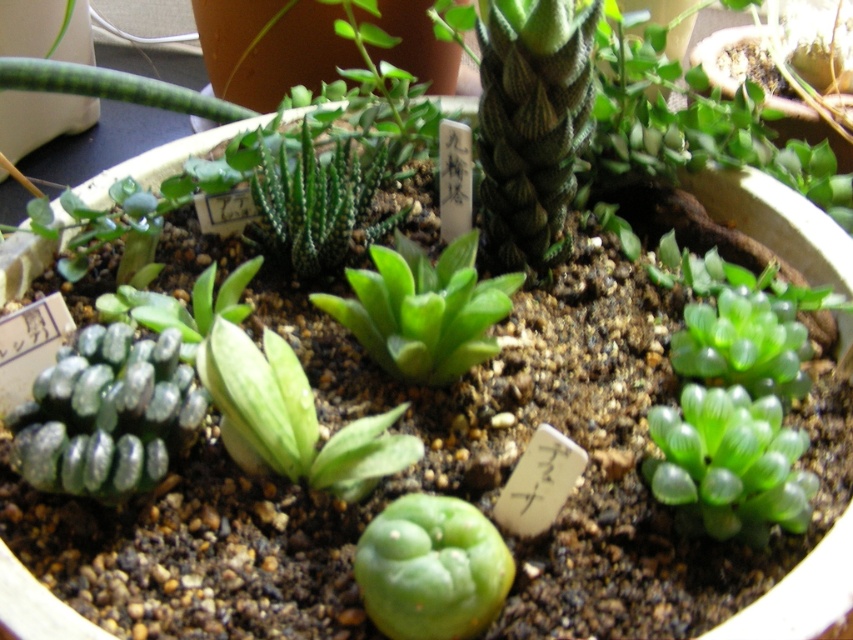
Question: Which object is farther from the camera taking this photo?

Choices:
 (A) translucent glass cylinder at center-right
 (B) green matte succulent at center

Answer: (A)

Question: Estimate the real-world distances between objects in this image. Which object is closer to the translucent glass cylinder at center-right?

Choices:
 (A) green textured stone at center
 (B) green matte/glossy cactus at center
 (C) green textured hexagonal cactus at center

Answer: (B)

Question: Considering the real-world distances, which object is closest to the green matte/glossy cactus at center?

Choices:
 (A) green matte succulent at center
 (B) translucent glass cylinder at center-right
 (C) green textured hexagonal cactus at center

Answer: (A)

Question: Can you confirm if translucent glass cylinder at center-right is bigger than green textured hexagonal cactus at center?

Choices:
 (A) no
 (B) yes

Answer: (A)

Question: Is green matte succulent at center bigger than green translucent succulent at center?

Choices:
 (A) no
 (B) yes

Answer: (B)

Question: Observing the image, what is the correct spatial positioning of green matte/glossy cactus at center in reference to green translucent succulent at center?

Choices:
 (A) above
 (B) below

Answer: (B)